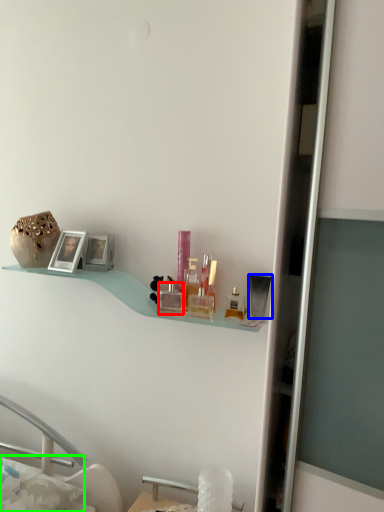
Question: Which object is positioned farthest from toiletry (highlighted by a red box)? Select from toiletry (highlighted by a blue box) and pillow (highlighted by a green box).

Choices:
 (A) toiletry
 (B) pillow

Answer: (B)